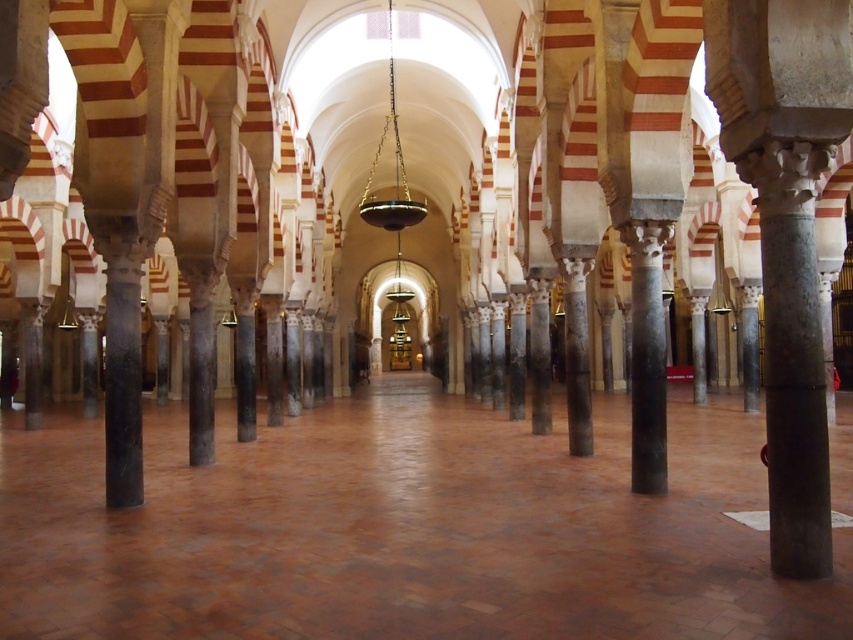
How distant is marble column at center from black marble pillar at center?

The distance of marble column at center from black marble pillar at center is 6.13 meters.

Is marble column at center positioned at the back of black marble pillar at center?

No, marble column at center is closer to the viewer.

The image size is (853, 640). In order to click on marble column at center in this screenshot , I will do `click(576, 355)`.